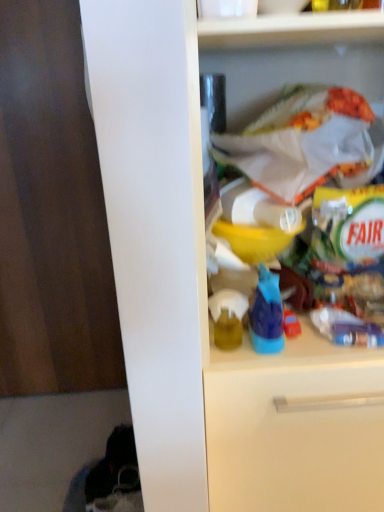
Describe the element at coordinates (51, 213) in the screenshot. I see `dark wood door at left` at that location.

Where is `matte yellow bottle at center`? matte yellow bottle at center is located at coordinates (228, 317).

Which of these two, matte yellow bottle at center or dark wood door at left, stands taller?

Standing taller between the two is dark wood door at left.

Can you see matte yellow bottle at center touching dark wood door at left?

matte yellow bottle at center is not next to dark wood door at left, and they're not touching.

Find the location of a particular element. The width and height of the screenshot is (384, 512). leftover behind the matte yellow bottle at center is located at coordinates (51, 213).

From a real-world perspective, relative to dark wood door at left, is matte yellow bottle at center vertically above or below?

matte yellow bottle at center is above dark wood door at left.

Is blue plastic bottle at center at the back of dark wood door at left?

No, blue plastic bottle at center is not at the back of dark wood door at left.

Is dark wood door at left beside blue plastic bottle at center?

No.

Considering the sizes of objects dark wood door at left and blue plastic bottle at center in the image provided, who is thinner, dark wood door at left or blue plastic bottle at center?

dark wood door at left.

Is blue plastic bottle at center oriented towards white plastic bag at upper right?

No, blue plastic bottle at center does not turn towards white plastic bag at upper right.

From a real-world perspective, between blue plastic bottle at center and white plastic bag at upper right, who is vertically lower?

From a 3D spatial view, blue plastic bottle at center is below.

Is there a large distance between blue plastic bottle at center and white plastic bag at upper right?

No.

Considering the relative positions of blue plastic bottle at center and white plastic bag at upper right in the image provided, is blue plastic bottle at center in front of white plastic bag at upper right?

No.

Which object is closer to the camera, white plastic bag at upper right or dark wood door at left?

Positioned in front is white plastic bag at upper right.

Is point (335, 140) closer or farther from the camera than point (0, 321)?

Point (335, 140).

Is white plastic bag at upper right oriented towards dark wood door at left?

No.

Looking at their sizes, would you say white plastic bag at upper right is wider or thinner than dark wood door at left?

Clearly, white plastic bag at upper right has more width compared to dark wood door at left.

Between white plastic bag at upper right and blue plastic bottle at center, which one has more height?

white plastic bag at upper right.

From the image's perspective, who appears lower, white plastic bag at upper right or blue plastic bottle at center?

From the image's view, blue plastic bottle at center is below.

Is white plastic bag at upper right beside blue plastic bottle at center?

No, white plastic bag at upper right is not in contact with blue plastic bottle at center.

Considering the positions of point (320, 130) and point (257, 308), is point (320, 130) closer or farther from the camera than point (257, 308)?

Point (320, 130).

Considering the sizes of objects matte yellow bottle at center and white plastic bag at upper right in the image provided, who is smaller, matte yellow bottle at center or white plastic bag at upper right?

matte yellow bottle at center.

Is point (230, 321) farther from camera compared to point (313, 118)?

No, it is in front of (313, 118).

Is white plastic bag at upper right located within matte yellow bottle at center?

No, white plastic bag at upper right is not a part of matte yellow bottle at center.

From the image's perspective, between matte yellow bottle at center and white plastic bag at upper right, which one is located above?

white plastic bag at upper right is shown above in the image.

Based on the photo, between dark wood door at left and white plastic bag at upper right, which one has less height?

white plastic bag at upper right is shorter.

Considering their positions, is dark wood door at left located in front of or behind white plastic bag at upper right?

dark wood door at left is positioned farther from the viewer than white plastic bag at upper right.

From a real-world perspective, which is physically above, dark wood door at left or white plastic bag at upper right?

white plastic bag at upper right, from a real-world perspective.

You are a GUI agent. You are given a task and a screenshot of the screen. Output one action in this format:
    pyautogui.click(x=<x>, y=<y>)
    Task: Click on the leftover above the matte yellow bottle at center (from the image's perspective)
    This screenshot has height=512, width=384.
    Given the screenshot: What is the action you would take?
    pyautogui.click(x=51, y=213)

At what (x,y) coordinates should I click in order to perform the action: click on bottle below the dark wood door at left (from the image's perspective). Please return your answer as a coordinate pair (x, y). Image resolution: width=384 pixels, height=512 pixels. Looking at the image, I should click on (267, 314).

From the image, which object appears to be farther from matte yellow bottle at center, blue plastic bottle at center or white plastic bag at upper right?

The object further to matte yellow bottle at center is white plastic bag at upper right.

Based on their spatial positions, is matte yellow bottle at center or blue plastic bottle at center closer to white plastic bag at upper right?

The object closer to white plastic bag at upper right is blue plastic bottle at center.

When comparing their distances from blue plastic bottle at center, does dark wood door at left or matte yellow bottle at center seem closer?

matte yellow bottle at center lies closer to blue plastic bottle at center than the other object.

Which object lies further to the anchor point matte yellow bottle at center, dark wood door at left or white plastic bag at upper right?

dark wood door at left is further to matte yellow bottle at center.

From the image, which object appears to be nearer to dark wood door at left, white plastic bag at upper right or blue plastic bottle at center?

The object closer to dark wood door at left is white plastic bag at upper right.

Considering their positions, is matte yellow bottle at center positioned closer to dark wood door at left than white plastic bag at upper right?

white plastic bag at upper right.

Estimate the real-world distances between objects in this image. Which object is further from blue plastic bottle at center, matte yellow bottle at center or white plastic bag at upper right?

white plastic bag at upper right.

Estimate the real-world distances between objects in this image. Which object is further from dark wood door at left, blue plastic bottle at center or white plastic bag at upper right?

blue plastic bottle at center.

In order to click on toy between dark wood door at left and blue plastic bottle at center in the horizontal direction in this screenshot , I will do `click(228, 317)`.

Find the location of a particular element. Image resolution: width=384 pixels, height=512 pixels. toy located between dark wood door at left and white plastic bag at upper right in the left-right direction is located at coordinates (228, 317).

Image resolution: width=384 pixels, height=512 pixels. In order to click on bottle between dark wood door at left and white plastic bag at upper right from left to right in this screenshot , I will do pos(267,314).

Image resolution: width=384 pixels, height=512 pixels. I want to click on bottle between white plastic bag at upper right and matte yellow bottle at center in the vertical direction, so click(267, 314).